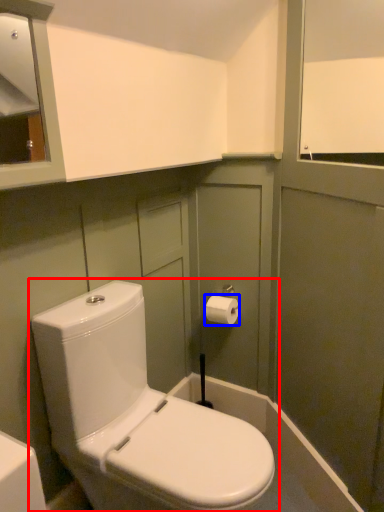
Question: Which point is closer to the camera, toilet (highlighted by a red box) or toiletry (highlighted by a blue box)?

Choices:
 (A) toilet
 (B) toiletry

Answer: (A)